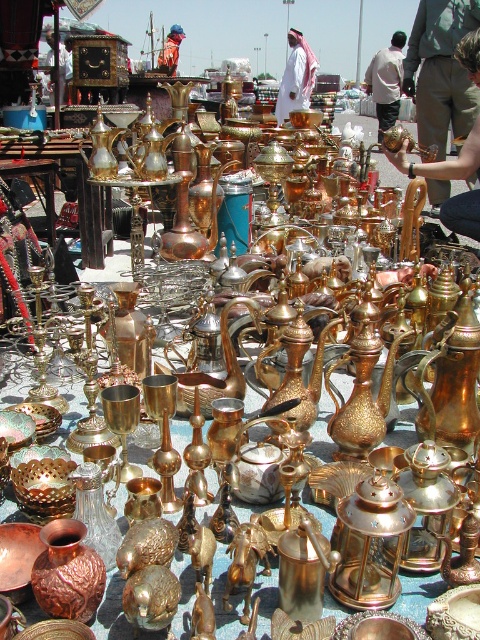
You are a vendor at the market and need to pack items into a box that can only accommodate items narrower than the white fabric shirt at upper center. Can the brushed metal helmet at upper center fit into the box?

The white fabric shirt at upper center is wider than the brushed metal helmet at upper center. Since the box can only take items narrower than the shirt, the brushed metal helmet at upper center can fit into the box.

Consider the image. You are a photographer standing at the market and want to capture both the point at coordinates point (466, 61) and the point at coordinates point (280, 115) in your photo. Which point will appear larger in your photo?

Point (466, 61) is closer to the camera than point (280, 115), so it will appear larger in the photo.